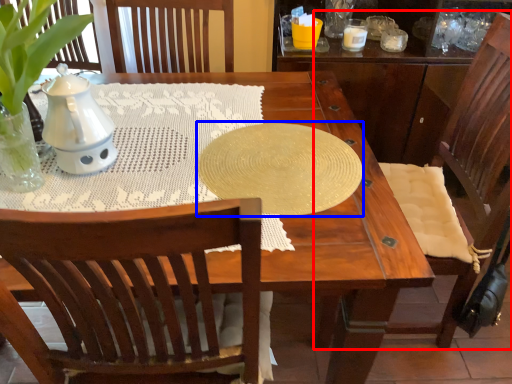
Question: Which of the following is the closest to the observer, chair (highlighted by a red box) or oval (highlighted by a blue box)?

Choices:
 (A) chair
 (B) oval

Answer: (A)